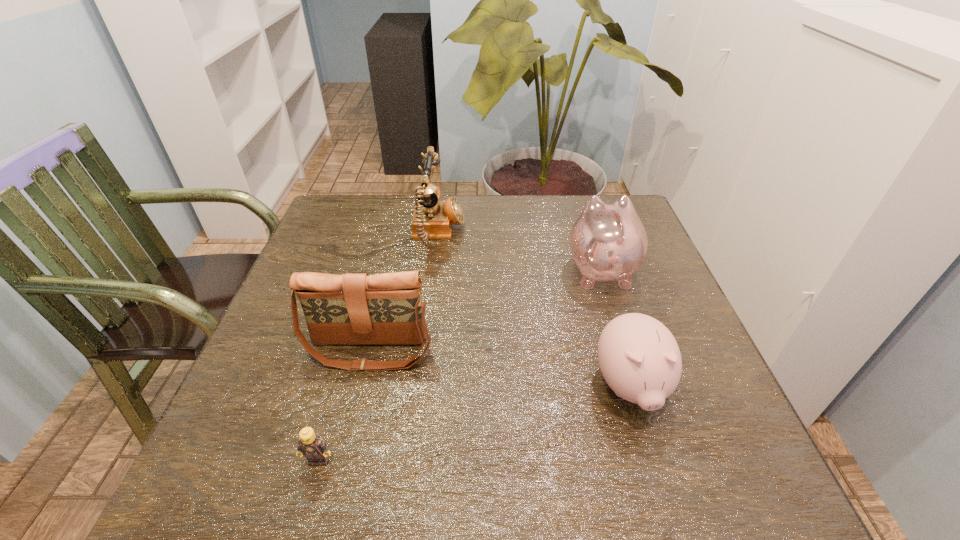
Where is `free space between the shortest object and the shoulder bag`? free space between the shortest object and the shoulder bag is located at coordinates (344, 405).

Find the location of a particular element. Image resolution: width=960 pixels, height=540 pixels. vacant space in between the telephone and the farther piggy bank is located at coordinates tap(519, 251).

The width and height of the screenshot is (960, 540). I want to click on object identified as the third closest to the taller piggy bank, so click(x=350, y=309).

Identify which object is located as the fourth nearest to the shoulder bag. Please provide its 2D coordinates. Your answer should be formatted as a tuple, i.e. [(x, y)], where the tuple contains the x and y coordinates of a point satisfying the conditions above.

[(608, 241)]

Where is `free space in the image that satisfies the following two spatial constraints: 1. on the front facing side of the taller piggy bank; 2. on the dial number of the telephone`? The image size is (960, 540). free space in the image that satisfies the following two spatial constraints: 1. on the front facing side of the taller piggy bank; 2. on the dial number of the telephone is located at coordinates (589, 233).

Identify the location of vacant point that satisfies the following two spatial constraints: 1. on the front facing side of the farther piggy bank; 2. on the dial number of the telephone. (589, 233).

Find the location of a particular element. Image resolution: width=960 pixels, height=540 pixels. vacant position in the image that satisfies the following two spatial constraints: 1. on the dial number of the telephone; 2. on the front-facing side of the shoulder bag is located at coordinates (424, 350).

Identify the location of vacant area that satisfies the following two spatial constraints: 1. on the front facing side of the taller piggy bank; 2. on the dial number of the telephone. The height and width of the screenshot is (540, 960). (589, 233).

The image size is (960, 540). In order to click on vacant position in the image that satisfies the following two spatial constraints: 1. on the dial number of the telephone; 2. on the front facing side of the taller piggy bank in this screenshot , I will do coord(434,270).

At what (x,y) coordinates should I click in order to perform the action: click on free space that satisfies the following two spatial constraints: 1. on the dial number of the telephone; 2. on the front-facing side of the shoulder bag. Please return your answer as a coordinate pair (x, y). Image resolution: width=960 pixels, height=540 pixels. Looking at the image, I should click on (424, 350).